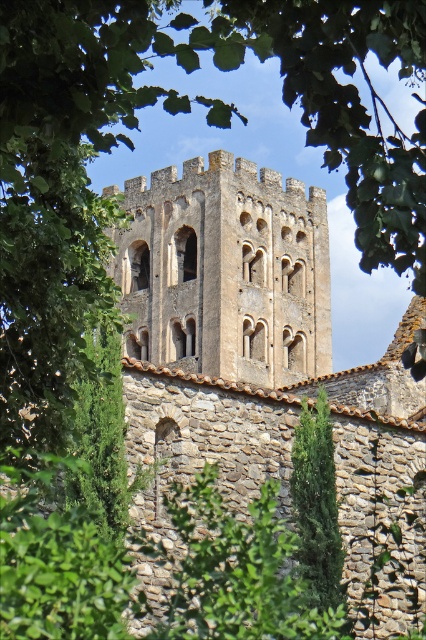
Is brown stone tower at center smaller than green textured stone tower at center?

Actually, brown stone tower at center might be larger than green textured stone tower at center.

Does brown stone tower at center have a greater height compared to green textured stone tower at center?

Yes.

Image resolution: width=426 pixels, height=640 pixels. I want to click on brown stone tower at center, so 247,344.